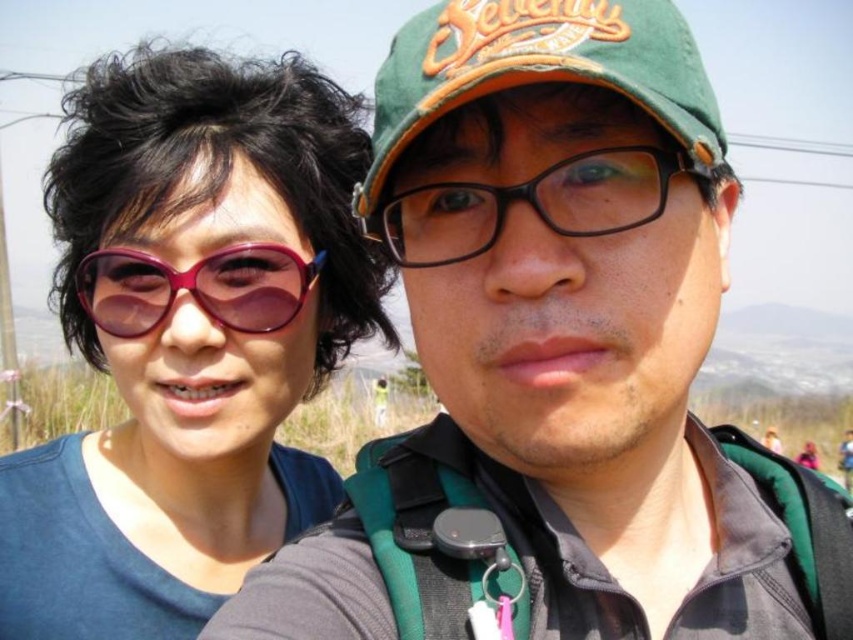
Is black plastic glasses at center thinner than pink glossy sunglasses at left?

Yes.

Does point (541, 182) come farther from viewer compared to point (94, 292)?

No, (541, 182) is in front of (94, 292).

You are a GUI agent. You are given a task and a screenshot of the screen. Output one action in this format:
    pyautogui.click(x=<x>, y=<y>)
    Task: Click on the black plastic glasses at center
    The height and width of the screenshot is (640, 853).
    Given the screenshot: What is the action you would take?
    pyautogui.click(x=531, y=204)

Is matte purple sunglasses at upper left thinner than green fabric baseball cap at upper center?

No, matte purple sunglasses at upper left is not thinner than green fabric baseball cap at upper center.

Is point (68, 289) behind point (567, 28)?

Yes, point (68, 289) is farther from viewer.

Locate an element on the screen. This screenshot has width=853, height=640. matte purple sunglasses at upper left is located at coordinates (189, 337).

How much distance is there between green fabric baseball cap at upper center and pink glossy sunglasses at left?

green fabric baseball cap at upper center is 48.72 centimeters from pink glossy sunglasses at left.

Which is more to the left, green fabric baseball cap at upper center or pink glossy sunglasses at left?

pink glossy sunglasses at left is more to the left.

Is point (675, 97) less distant than point (274, 321)?

Yes, it is.

Find the location of a particular element. green fabric baseball cap at upper center is located at coordinates (538, 72).